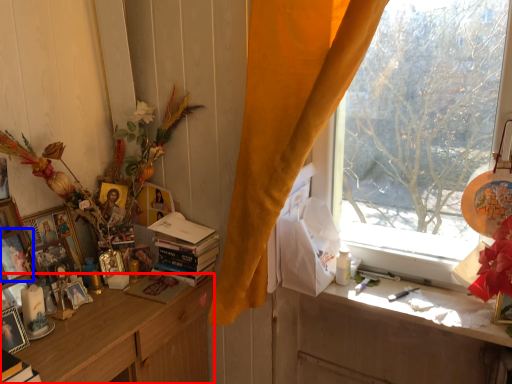
Question: Among these objects, which one is nearest to the camera, cabinetry (highlighted by a red box) or picture frame (highlighted by a blue box)?

Choices:
 (A) cabinetry
 (B) picture frame

Answer: (A)